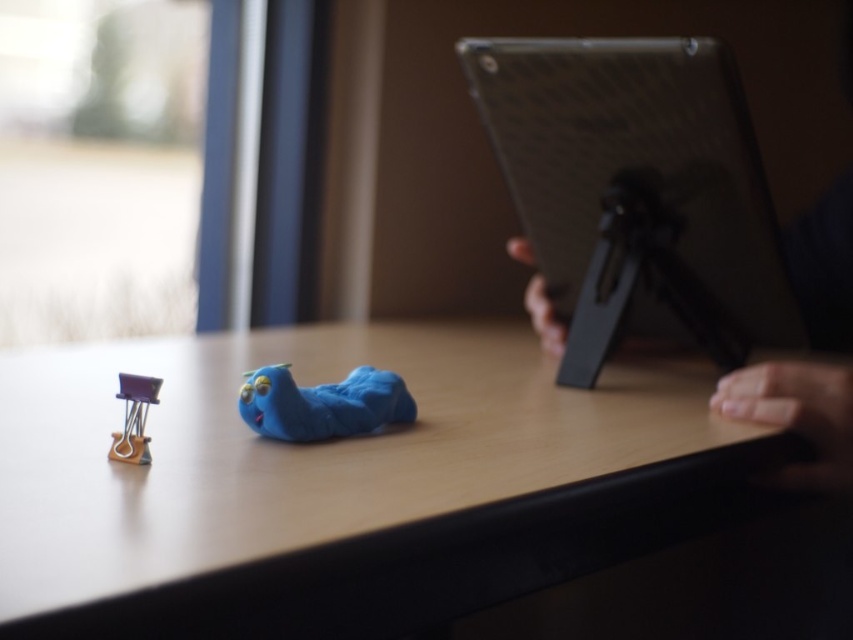
Question: Is matte black tablet at right closer to the viewer compared to matte plastic toy at center?

Choices:
 (A) yes
 (B) no

Answer: (B)

Question: Which object is the closest to the matte plastic toy at center?

Choices:
 (A) matte black tablet at right
 (B) purple plastic clip at lower left
 (C) matte plastic table at center

Answer: (B)

Question: Is matte black tablet at right smaller than matte plastic toy at center?

Choices:
 (A) no
 (B) yes

Answer: (A)

Question: Among these points, which one is nearest to the camera?

Choices:
 (A) (335, 516)
 (B) (131, 394)
 (C) (563, 310)

Answer: (A)

Question: Can you confirm if matte plastic table at center is thinner than purple plastic clip at lower left?

Choices:
 (A) no
 (B) yes

Answer: (A)

Question: Which object appears farthest from the camera in this image?

Choices:
 (A) matte plastic table at center
 (B) matte plastic toy at center
 (C) purple plastic clip at lower left

Answer: (B)